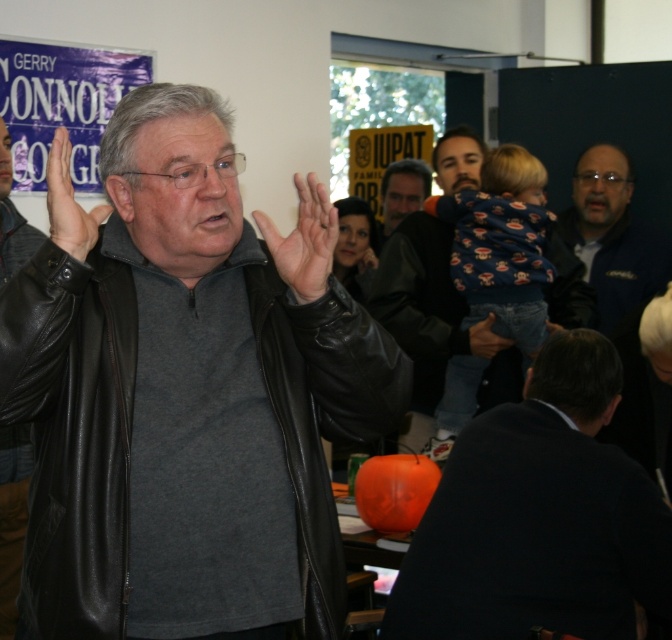
Is dark gray leather jacket at center bigger than leather at center?

Yes.

Which is in front, point (493, 419) or point (56, 164)?

Point (56, 164)

Where is `dark gray leather jacket at center`? This screenshot has width=672, height=640. dark gray leather jacket at center is located at coordinates (540, 516).

Image resolution: width=672 pixels, height=640 pixels. What do you see at coordinates (11, 516) in the screenshot? I see `leather jacket at center` at bounding box center [11, 516].

Is point (1, 621) positioned in front of point (403, 212)?

Yes.

Who is more distant from viewer, (0,560) or (394,221)?

The point (394,221) is behind.

In order to click on leather jacket at center in this screenshot , I will do `click(11, 516)`.

Is the position of blue fleece jacket at right less distant than that of smooth gray shirt at center?

Yes, blue fleece jacket at right is closer to the viewer.

Describe the element at coordinates (612, 234) in the screenshot. I see `blue fleece jacket at right` at that location.

This screenshot has width=672, height=640. I want to click on blue fleece jacket at right, so click(x=612, y=234).